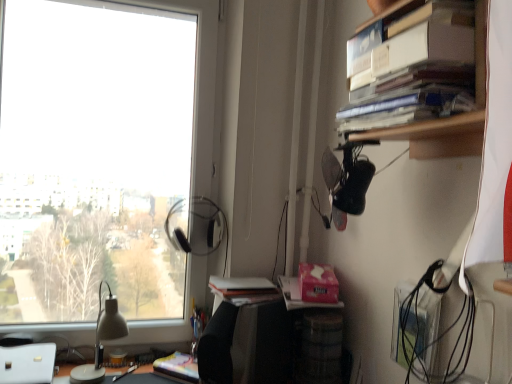
What are the coordinates of `hardcover books at upper right` in the screenshot? It's located at (449, 118).

In order to click on multicolored paper at lower center in this screenshot , I will do `click(178, 367)`.

This screenshot has width=512, height=384. What are the coordinates of `matte black desk at lower center` in the screenshot? It's located at (146, 377).

Measure the distance between point (x=56, y=46) and camera.

Point (x=56, y=46) is 1.50 meters away from camera.

Measure the distance between point (244, 301) and camera.

The depth of point (244, 301) is 1.36 meters.

I want to click on white matte book at center, so click(241, 288).

Locate an element on the screen. hardcover books at upper right is located at coordinates (449, 118).

From the image's perspective, is matte black desk at lower center beneath multicolored paper at lower center?

Indeed, from the image's perspective, matte black desk at lower center is shown beneath multicolored paper at lower center.

Is matte black desk at lower center smaller than multicolored paper at lower center?

No, matte black desk at lower center is not smaller than multicolored paper at lower center.

From a real-world perspective, is matte black desk at lower center physically located above or below multicolored paper at lower center?

matte black desk at lower center is situated lower than multicolored paper at lower center in the real world.

Can you confirm if matte black desk at lower center is taller than multicolored paper at lower center?

In fact, matte black desk at lower center may be shorter than multicolored paper at lower center.

Does transparent glass window at upper left have a greater width compared to white matte book at center?

Incorrect, the width of transparent glass window at upper left does not surpass that of white matte book at center.

From a real-world perspective, is transparent glass window at upper left positioned above or below white matte book at center?

In terms of real-world spatial position, transparent glass window at upper left is above white matte book at center.

Is transparent glass window at upper left positioned with its back to white matte book at center?

No, white matte book at center is not at the back of transparent glass window at upper left.

Is multicolored paper at lower center looking in the opposite direction of transparent glass window at upper left?

No, transparent glass window at upper left is not at the back of multicolored paper at lower center.

In terms of width, does multicolored paper at lower center look wider or thinner when compared to transparent glass window at upper left?

In the image, multicolored paper at lower center appears to be wider than transparent glass window at upper left.

Between multicolored paper at lower center and transparent glass window at upper left, which one appears on the left side from the viewer's perspective?

From the viewer's perspective, transparent glass window at upper left appears more on the left side.

Consider the image. Is multicolored paper at lower center with transparent glass window at upper left?

No, multicolored paper at lower center is not with transparent glass window at upper left.

Which of these two, white matte book at center or hardcover books at upper right, is smaller?

Smaller between the two is white matte book at center.

Which of these two, white matte book at center or hardcover books at upper right, is wider?

With larger width is white matte book at center.

Does white matte book at center appear on the right side of hardcover books at upper right?

Incorrect, white matte book at center is not on the right side of hardcover books at upper right.

Considering the positions of objects matte black desk at lower center and white matte book at center in the image provided, who is more to the left, matte black desk at lower center or white matte book at center?

matte black desk at lower center.

Would you say matte black desk at lower center is inside or outside white matte book at center?

matte black desk at lower center is located beyond the bounds of white matte book at center.

Considering the sizes of matte black desk at lower center and white matte book at center in the image, is matte black desk at lower center bigger or smaller than white matte book at center?

matte black desk at lower center is smaller than white matte book at center.

From a real-world perspective, does matte black desk at lower center stand above white matte book at center?

Incorrect, from a real-world perspective, matte black desk at lower center is lower than white matte book at center.

Is matte white lamp at left further to the viewer compared to multicolored paper at lower center?

No.

Consider the image. Between matte white lamp at left and multicolored paper at lower center, which one has more height?

With more height is matte white lamp at left.

Which object is wider, matte white lamp at left or multicolored paper at lower center?

With larger width is matte white lamp at left.

Which of these two, matte white lamp at left or multicolored paper at lower center, is smaller?

With smaller size is multicolored paper at lower center.

I want to click on cabinetry lying in front of the white matte book at center, so click(x=449, y=118).

Measure the distance between hardcover books at upper right and white matte book at center.

The distance of hardcover books at upper right from white matte book at center is 29.72 inches.

From the image's perspective, between hardcover books at upper right and white matte book at center, which one is located above?

hardcover books at upper right, from the image's perspective.

Can you confirm if hardcover books at upper right is wider than white matte book at center?

No.

Locate an element on the screen. This screenshot has width=512, height=384. desk that is in front of the multicolored paper at lower center is located at coordinates (146, 377).

Where is `window above the white matte book at center (from a real-world perspective)`? This screenshot has width=512, height=384. window above the white matte book at center (from a real-world perspective) is located at coordinates (104, 159).

Looking at this image, estimate the real-world distances between objects in this image. Which object is further from hardcover books at upper right, matte black desk at lower center or matte white lamp at left?

Based on the image, matte black desk at lower center appears to be further to hardcover books at upper right.

Considering their positions, is white matte book at center positioned closer to multicolored paper at lower center than hardcover books at upper right?

Based on the image, white matte book at center appears to be nearer to multicolored paper at lower center.

Based on the photo, which object lies further to the anchor point matte white lamp at left, white matte book at center or multicolored paper at lower center?

white matte book at center lies further to matte white lamp at left than the other object.

Based on their spatial positions, is hardcover books at upper right or matte white lamp at left further from matte black desk at lower center?

The object further to matte black desk at lower center is hardcover books at upper right.

Looking at the image, which one is located closer to transparent glass window at upper left, matte black desk at lower center or white matte book at center?

white matte book at center is positioned closer to the anchor transparent glass window at upper left.

Looking at this image, looking at the image, which one is located further to hardcover books at upper right, multicolored paper at lower center or matte white lamp at left?

Based on the image, matte white lamp at left appears to be further to hardcover books at upper right.

Looking at this image, from the image, which object appears to be nearer to transparent glass window at upper left, matte white lamp at left or white matte book at center?

matte white lamp at left is positioned closer to the anchor transparent glass window at upper left.

From the image, which object appears to be nearer to matte black desk at lower center, multicolored paper at lower center or matte white lamp at left?

multicolored paper at lower center.

Where is `desk located between matte white lamp at left and white matte book at center in the left-right direction`? The width and height of the screenshot is (512, 384). desk located between matte white lamp at left and white matte book at center in the left-right direction is located at coordinates (146, 377).

Locate an element on the screen. lamp situated between transparent glass window at upper left and hardcover books at upper right from left to right is located at coordinates (100, 340).

Where is `book between matte black desk at lower center and multicolored paper at lower center along the z-axis`? The image size is (512, 384). book between matte black desk at lower center and multicolored paper at lower center along the z-axis is located at coordinates pos(241,288).

Identify the location of window between hardcover books at upper right and matte black desk at lower center in the up-down direction. The height and width of the screenshot is (384, 512). (104, 159).